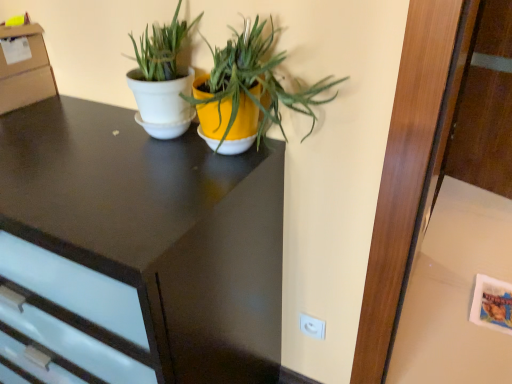
Question: Does white glossy pot at center, which is the 1th houseplant from left to right, have a greater height compared to white glossy pot at center, the first houseplant from the right?

Choices:
 (A) yes
 (B) no

Answer: (A)

Question: From the image's perspective, is white glossy pot at center, marked as the second houseplant in a right-to-left arrangement, below white glossy pot at center, the first houseplant from the right?

Choices:
 (A) no
 (B) yes

Answer: (A)

Question: Would you say white glossy pot at center, which is the 1th houseplant from left to right, is outside white glossy pot at center, which is the second houseplant in left-to-right order?

Choices:
 (A) no
 (B) yes

Answer: (B)

Question: Can you confirm if white glossy pot at center, which is the 1th houseplant from left to right, is positioned to the left of white glossy pot at center, the first houseplant from the right?

Choices:
 (A) no
 (B) yes

Answer: (B)

Question: Considering the relative sizes of white glossy pot at center, marked as the second houseplant in a right-to-left arrangement, and white glossy pot at center, the first houseplant from the right, in the image provided, is white glossy pot at center, marked as the second houseplant in a right-to-left arrangement, wider than white glossy pot at center, the first houseplant from the right,?

Choices:
 (A) no
 (B) yes

Answer: (A)

Question: From the image's perspective, relative to white glossy table at lower right, is matte black desk at center above or below?

Choices:
 (A) below
 (B) above

Answer: (B)

Question: Is matte black desk at center in front of or behind white glossy table at lower right in the image?

Choices:
 (A) front
 (B) behind

Answer: (A)

Question: In terms of height, does matte black desk at center look taller or shorter compared to white glossy table at lower right?

Choices:
 (A) short
 (B) tall

Answer: (B)

Question: In the image, is matte black desk at center on the left side or the right side of white glossy table at lower right?

Choices:
 (A) right
 (B) left

Answer: (B)

Question: Does point (314, 324) appear closer or farther from the camera than point (56, 377)?

Choices:
 (A) farther
 (B) closer

Answer: (A)

Question: Based on their sizes in the image, would you say white plastic electric outlet at lower right is bigger or smaller than matte black desk at center?

Choices:
 (A) big
 (B) small

Answer: (B)

Question: Considering the positions of white plastic electric outlet at lower right and matte black desk at center in the image, is white plastic electric outlet at lower right wider or thinner than matte black desk at center?

Choices:
 (A) thin
 (B) wide

Answer: (A)

Question: From the image's perspective, is white plastic electric outlet at lower right positioned above or below matte black desk at center?

Choices:
 (A) above
 (B) below

Answer: (B)

Question: In terms of height, does white glossy table at lower right look taller or shorter compared to white plastic electric outlet at lower right?

Choices:
 (A) tall
 (B) short

Answer: (B)

Question: From the image's perspective, relative to white plastic electric outlet at lower right, is white glossy table at lower right above or below?

Choices:
 (A) below
 (B) above

Answer: (B)